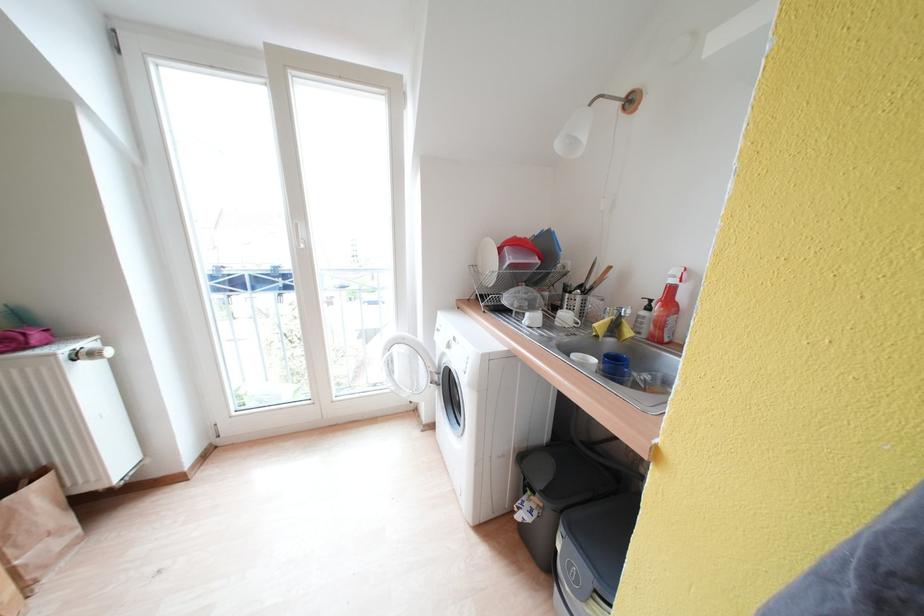
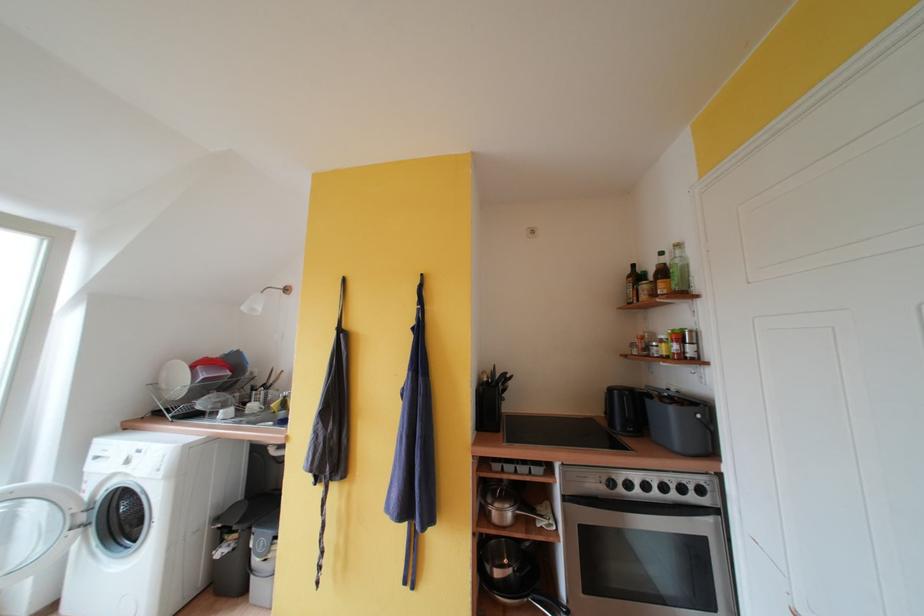
Locate, in the second image, the point that corresponds to [434,368] in the first image.

(76, 509)